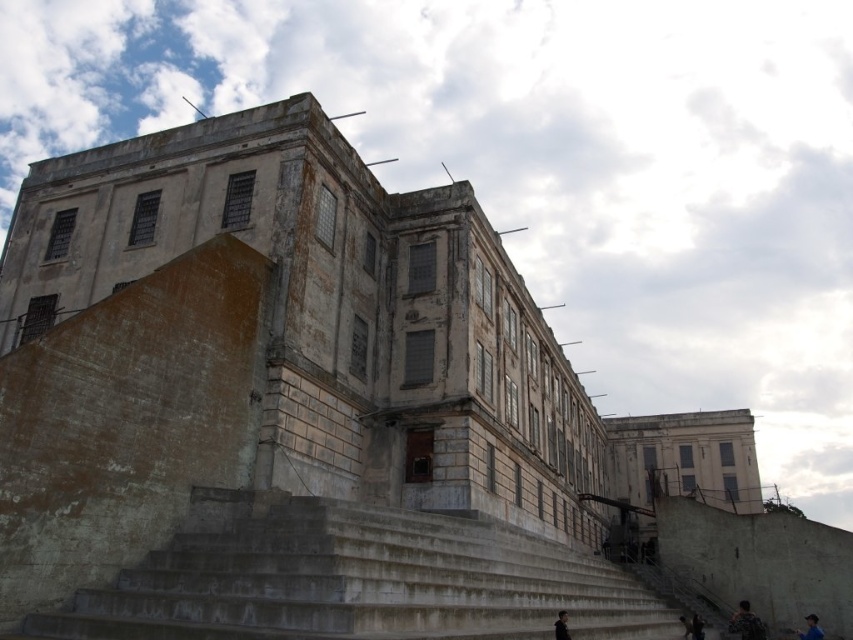
In the scene shown: You are standing in front of a large, imposing building with a weathered facade. You notice a dark hair at lower right. Where exactly is the dark hair located in relation to the building?

The dark hair at lower right is located at point coordinates of 0.980 on the x axis and 0.812 on the y axis.

You are standing in front of the building and see the dark hair at lower right and the dark gray concrete person at lower center. Which object is positioned more to the right side of the scene?

The dark hair at lower right is positioned more to the right side of the scene than the dark gray concrete person at lower center.